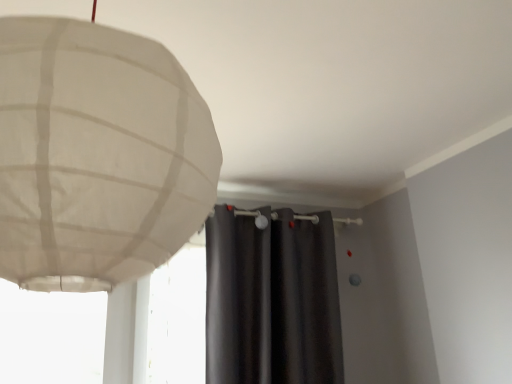
Locate an element on the screen. The height and width of the screenshot is (384, 512). white paper lampshade at upper left is located at coordinates (97, 155).

Describe the element at coordinates (97, 155) in the screenshot. The height and width of the screenshot is (384, 512). I see `white paper lampshade at upper left` at that location.

Image resolution: width=512 pixels, height=384 pixels. Find the location of `dark gray matte curtain at center`. dark gray matte curtain at center is located at coordinates (272, 300).

This screenshot has width=512, height=384. What do you see at coordinates (272, 300) in the screenshot?
I see `dark gray matte curtain at center` at bounding box center [272, 300].

Locate an element on the screen. The height and width of the screenshot is (384, 512). white paper lampshade at upper left is located at coordinates (97, 155).

Is white paper lampshade at upper left to the left or to the right of dark gray matte curtain at center in the image?

white paper lampshade at upper left is positioned on dark gray matte curtain at center's left side.

Is the depth of white paper lampshade at upper left greater than that of dark gray matte curtain at center?

No, white paper lampshade at upper left is in front of dark gray matte curtain at center.

Between point (33, 201) and point (224, 352), which one is positioned behind?

Point (224, 352)

From the image's perspective, is white paper lampshade at upper left located beneath dark gray matte curtain at center?

Actually, white paper lampshade at upper left appears above dark gray matte curtain at center in the image.

From a real-world perspective, which object rests below the other?

In real-world perspective, dark gray matte curtain at center is lower.

Can you confirm if white paper lampshade at upper left is wider than dark gray matte curtain at center?

Indeed, white paper lampshade at upper left has a greater width compared to dark gray matte curtain at center.

Is white paper lampshade at upper left shorter than dark gray matte curtain at center?

Indeed, white paper lampshade at upper left has a lesser height compared to dark gray matte curtain at center.

Can you confirm if white paper lampshade at upper left is bigger than dark gray matte curtain at center?

No.

From the picture: Is dark gray matte curtain at center completely or partially inside white paper lampshade at upper left?

Definitely not — dark gray matte curtain at center is not inside white paper lampshade at upper left.

Is white paper lampshade at upper left not near dark gray matte curtain at center?

Yes, white paper lampshade at upper left is far from dark gray matte curtain at center.

Is white paper lampshade at upper left oriented towards dark gray matte curtain at center?

No, white paper lampshade at upper left is not oriented towards dark gray matte curtain at center.

How many degrees apart are the facing directions of white paper lampshade at upper left and dark gray matte curtain at center?

90 degrees.

How far apart are white paper lampshade at upper left and dark gray matte curtain at center?

A distance of 1.85 meters exists between white paper lampshade at upper left and dark gray matte curtain at center.

Identify the location of lamp above the dark gray matte curtain at center (from the image's perspective). The height and width of the screenshot is (384, 512). (97, 155).

Considering the relative positions of dark gray matte curtain at center and white paper lampshade at upper left in the image provided, is dark gray matte curtain at center to the left of white paper lampshade at upper left from the viewer's perspective?

Incorrect, dark gray matte curtain at center is not on the left side of white paper lampshade at upper left.

Which is in front, dark gray matte curtain at center or white paper lampshade at upper left?

white paper lampshade at upper left is more forward.

Does point (237, 251) come closer to viewer compared to point (121, 53)?

No.

From the image's perspective, is dark gray matte curtain at center positioned above or below white paper lampshade at upper left?

Based on their image positions, dark gray matte curtain at center is located beneath white paper lampshade at upper left.

From a real-world perspective, is dark gray matte curtain at center on top of white paper lampshade at upper left?

Incorrect, from a real-world perspective, dark gray matte curtain at center is lower than white paper lampshade at upper left.

Considering the sizes of dark gray matte curtain at center and white paper lampshade at upper left in the image, is dark gray matte curtain at center wider or thinner than white paper lampshade at upper left?

Considering their sizes, dark gray matte curtain at center looks slimmer than white paper lampshade at upper left.

Is dark gray matte curtain at center taller or shorter than white paper lampshade at upper left?

In the image, dark gray matte curtain at center appears to be taller than white paper lampshade at upper left.

Does dark gray matte curtain at center have a smaller size compared to white paper lampshade at upper left?

No, dark gray matte curtain at center is not smaller than white paper lampshade at upper left.

Does dark gray matte curtain at center contain white paper lampshade at upper left?

Definitely not — white paper lampshade at upper left is not inside dark gray matte curtain at center.

In the scene shown: Is dark gray matte curtain at center next to white paper lampshade at upper left and touching it?

No, dark gray matte curtain at center is not with white paper lampshade at upper left.

Is dark gray matte curtain at center looking in the opposite direction of white paper lampshade at upper left?

dark gray matte curtain at center does not have its back to white paper lampshade at upper left.

How different are the orientations of dark gray matte curtain at center and white paper lampshade at upper left in degrees?

90 degrees.

Find the location of `lamp on the left of dark gray matte curtain at center`. lamp on the left of dark gray matte curtain at center is located at coordinates (97, 155).

I want to click on lamp to the left of dark gray matte curtain at center, so click(97, 155).

This screenshot has height=384, width=512. In the image, there is a dark gray matte curtain at center. Find the location of `lamp above it (from the image's perspective)`. lamp above it (from the image's perspective) is located at coordinates (97, 155).